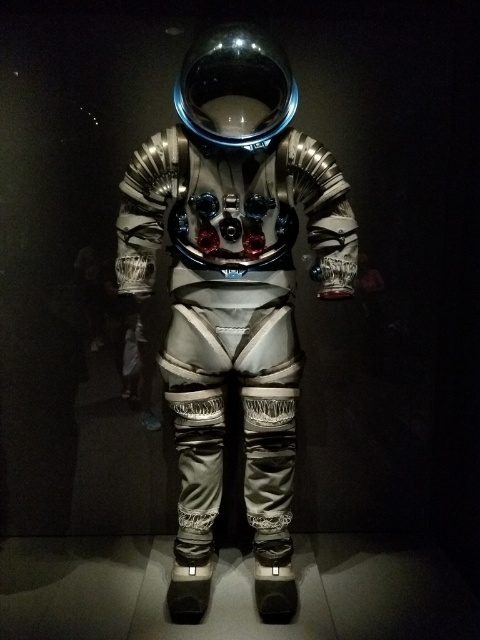
You are an astronaut preparing for a spacewalk and need to locate two points on the space suit displayed in the museum. The first point is at coordinates point (317, 148) and the second is point (262, 93). Which point is closer to you when you are facing the suit?

Point (262, 93) is closer to you because it is in front of point (317, 148).

You are standing in front of the space suit exhibit. You want to take a photo of the point at coordinates point (216, 208). If your camera has a focal length of 50mm and you are currently 3 meters away from the space suit, should you move closer or farther away to focus on that point?

The point (216, 208) is 1.44 meters from the camera. Since you are currently 3 meters away from the space suit, you need to move closer to reduce the distance to 1.44 meters to focus on that point.